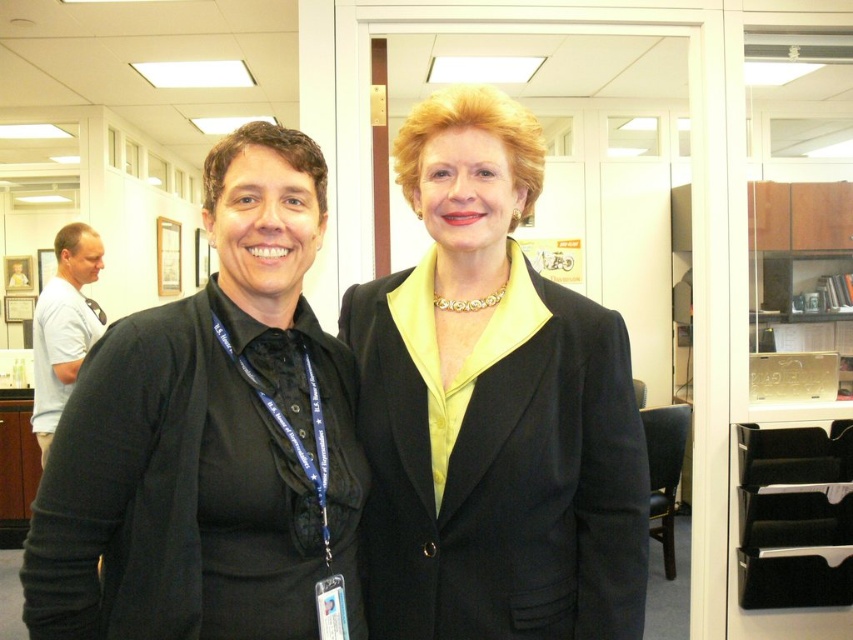
Between black satin blazer at center and black matte blazer at left, which one appears on the right side from the viewer's perspective?

black satin blazer at center

Between point (624, 506) and point (252, 600), which one is positioned behind?

The point (624, 506) is behind.

Where is `black satin blazer at center`? black satin blazer at center is located at coordinates (492, 408).